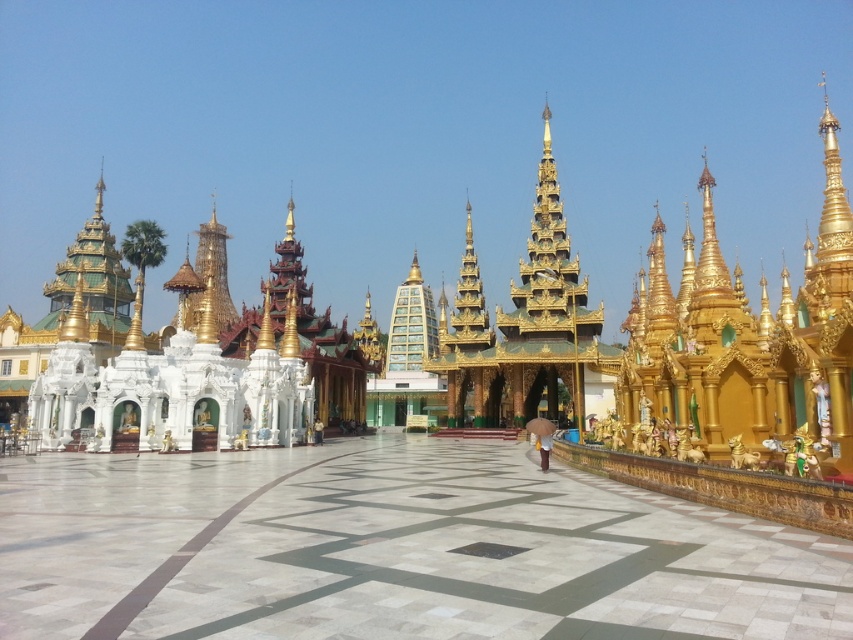
Which is more to the left, white marble plaza at center or brown fabric umbrella at center?

white marble plaza at center is more to the left.

Which of these two, white marble plaza at center or brown fabric umbrella at center, stands taller?

Standing taller between the two is brown fabric umbrella at center.

Which is behind, point (374, 545) or point (538, 435)?

Positioned behind is point (538, 435).

Find the location of a particular element. This screenshot has width=853, height=640. white marble plaza at center is located at coordinates (392, 550).